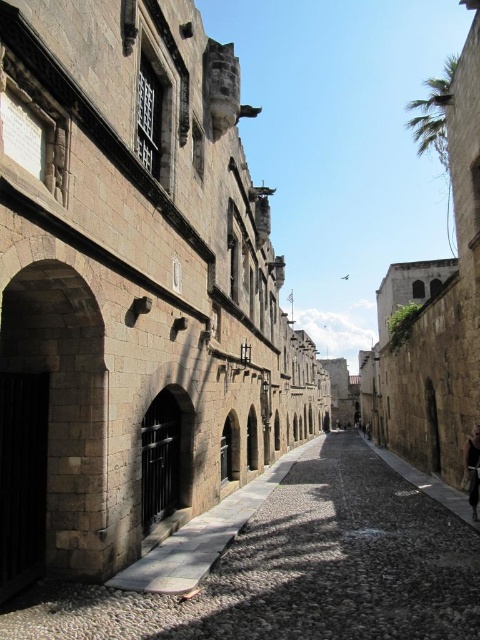
Is stone paved alley at center above dark brown leather jacket at lower right?

No.

Measure the distance between point (295,600) and camera.

They are 45.47 meters apart.

Where is `stone paved alley at center`? This screenshot has height=640, width=480. stone paved alley at center is located at coordinates (300, 570).